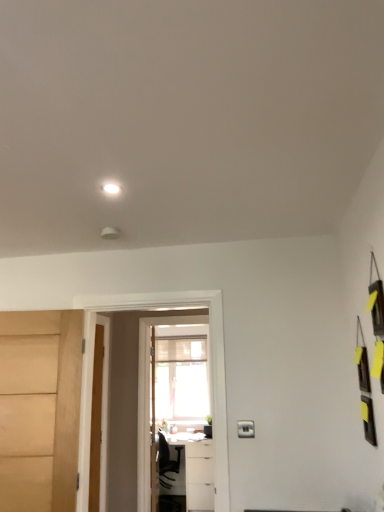
Find the location of a particular element. The height and width of the screenshot is (512, 384). matte wood door at left, placed as the 1th door when sorted from front to back is located at coordinates coord(39,409).

What is the approximate width of transparent glass screen door at center?

transparent glass screen door at center is 5.28 centimeters wide.

What do you see at coordinates (153, 432) in the screenshot? The width and height of the screenshot is (384, 512). I see `wooden door at center, which is counted as the 1th door, starting from the right` at bounding box center [153, 432].

Describe the element at coordinates (111, 188) in the screenshot. The height and width of the screenshot is (512, 384). I see `white glossy light at upper center` at that location.

The image size is (384, 512). Describe the element at coordinates (99, 417) in the screenshot. I see `wooden door at center, arranged as the second door when viewed from the back` at that location.

In order to face wooden door at center, the 2th door positioned from the left, should I rotate leftwards or rightwards?

You should look left and rotate roughly 13.026 degrees.

At what (x,y) coordinates should I click in order to perform the action: click on white glossy table at lower center. Please return your answer as a coordinate pair (x, y). The image size is (384, 512). Looking at the image, I should click on (188, 478).

Could you tell me if white glossy light at upper center is facing matte wood door at left, placed as the 1th door when sorted from front to back?

No.

From a real-world perspective, is white glossy light at upper center under matte wood door at left, positioned as the third door in right-to-left order?

Incorrect, from a real-world perspective, white glossy light at upper center is higher than matte wood door at left, positioned as the third door in right-to-left order.

Between white glossy light at upper center and matte wood door at left, which ranks as the 3th door in back-to-front order, which one appears on the right side from the viewer's perspective?

Result: Positioned to the right is white glossy light at upper center.

From their relative heights in the image, would you say white glossy light at upper center is taller or shorter than matte wood door at left, which ranks as the 3th door in back-to-front order?

Clearly, white glossy light at upper center is shorter compared to matte wood door at left, which ranks as the 3th door in back-to-front order.

Which object is positioned more to the right, transparent glass screen door at center or white glossy light at upper center?

transparent glass screen door at center is more to the right.

Between transparent glass screen door at center and white glossy light at upper center, which one has larger size?

With larger size is transparent glass screen door at center.

Is point (173, 413) closer or farther from the camera than point (113, 184)?

Point (173, 413) is farther from the camera than point (113, 184).

Could white glossy light at upper center be considered to be inside transparent glass screen door at center?

That's incorrect, white glossy light at upper center is not inside transparent glass screen door at center.

Can you tell me how much transparent glass screen door at center and matte wood door at left, which ranks as the 3th door in back-to-front order, differ in facing direction?

11.7 degrees separate the facing orientations of transparent glass screen door at center and matte wood door at left, which ranks as the 3th door in back-to-front order.

From a real-world perspective, is transparent glass screen door at center beneath matte wood door at left, placed as the 1th door when sorted from front to back?

Yes, from a real-world perspective, transparent glass screen door at center is below matte wood door at left, placed as the 1th door when sorted from front to back.

Could you tell me if transparent glass screen door at center is turned towards matte wood door at left, which appears as the 1th door when viewed from the left?

No, transparent glass screen door at center is not facing towards matte wood door at left, which appears as the 1th door when viewed from the left.

This screenshot has width=384, height=512. What are the coordinates of `screen door behind the matte wood door at left, which appears as the 1th door when viewed from the left` in the screenshot? It's located at (182, 380).

Is matte wood door at left, which ranks as the 3th door in back-to-front order, spatially inside white glossy light at upper center, or outside of it?

matte wood door at left, which ranks as the 3th door in back-to-front order, is not inside white glossy light at upper center, it's outside.

From a real-world perspective, is matte wood door at left, placed as the 1th door when sorted from front to back, positioned above or below white glossy light at upper center?

In terms of real-world spatial position, matte wood door at left, placed as the 1th door when sorted from front to back, is below white glossy light at upper center.

From the image's perspective, is matte wood door at left, placed as the 1th door when sorted from front to back, above or below white glossy light at upper center?

Based on their image positions, matte wood door at left, placed as the 1th door when sorted from front to back, is located beneath white glossy light at upper center.

Identify the location of door that is the 1st one when counting backward from the white glossy light at upper center. (39, 409).

Considering the relative sizes of transparent glass screen door at center and wooden door at center, the 3th door in the front-to-back sequence, in the image provided, is transparent glass screen door at center shorter than wooden door at center, the 3th door in the front-to-back sequence,?

Yes.

Looking at the image, does transparent glass screen door at center seem bigger or smaller compared to wooden door at center, which is counted as the 1th door, starting from the right?

transparent glass screen door at center is smaller than wooden door at center, which is counted as the 1th door, starting from the right.

Would you say transparent glass screen door at center is outside wooden door at center, the 3th door in the front-to-back sequence?

Yes, transparent glass screen door at center is outside of wooden door at center, the 3th door in the front-to-back sequence.

Between transparent glass screen door at center and wooden door at center, the 3th door in the front-to-back sequence, which one appears on the right side from the viewer's perspective?

transparent glass screen door at center is more to the right.

From the picture: Which object is closer to the camera, wooden door at center, the 2th door positioned from the left, or white glossy light at upper center?

white glossy light at upper center is closer to the camera.

In the scene shown: Would you say wooden door at center, the 2th door in the front-to-back sequence, is to the left or to the right of white glossy light at upper center in the picture?

wooden door at center, the 2th door in the front-to-back sequence, is positioned on white glossy light at upper center's left side.

Are wooden door at center, the 2th door in the front-to-back sequence, and white glossy light at upper center making contact?

There is a gap between wooden door at center, the 2th door in the front-to-back sequence, and white glossy light at upper center.

Does point (99, 322) appear closer or farther from the camera than point (110, 183)?

Point (99, 322) appears to be farther away from the viewer than point (110, 183).

Which is less distant, [4,396] or [93,502]?

Point [4,396] is positioned closer to the camera compared to point [93,502].

In the scene shown: Could you tell me if matte wood door at left, positioned as the third door in right-to-left order, is turned towards wooden door at center, the second door when ordered from right to left?

No, matte wood door at left, positioned as the third door in right-to-left order, is not aimed at wooden door at center, the second door when ordered from right to left.

What's the angular difference between matte wood door at left, placed as the 1th door when sorted from front to back, and wooden door at center, the 2th door in the front-to-back sequence,'s facing directions?

There is a 78.3-degree angle between the facing directions of matte wood door at left, placed as the 1th door when sorted from front to back, and wooden door at center, the 2th door in the front-to-back sequence.

Between matte wood door at left, positioned as the third door in right-to-left order, and wooden door at center, the second door when ordered from right to left, which one has larger width?

Wider between the two is matte wood door at left, positioned as the third door in right-to-left order.

Where is `light that appears above the matte wood door at left, placed as the 1th door when sorted from front to back (from the image's perspective)`? This screenshot has width=384, height=512. light that appears above the matte wood door at left, placed as the 1th door when sorted from front to back (from the image's perspective) is located at coordinates (111, 188).

Locate an element on the screen. The image size is (384, 512). screen door behind the white glossy light at upper center is located at coordinates (182, 380).

Which object lies further to the anchor point transparent glass screen door at center, matte wood door at left, which ranks as the 3th door in back-to-front order, or white glossy table at lower center?

matte wood door at left, which ranks as the 3th door in back-to-front order, is positioned further to the anchor transparent glass screen door at center.

When comparing their distances from matte wood door at left, which ranks as the 3th door in back-to-front order, does transparent glass screen door at center or wooden door at center, which is counted as the 1th door, starting from the right, seem closer?

wooden door at center, which is counted as the 1th door, starting from the right, lies closer to matte wood door at left, which ranks as the 3th door in back-to-front order, than the other object.

Which object lies further to the anchor point transparent glass screen door at center, wooden door at center, the 2th door in the front-to-back sequence, or white glossy table at lower center?

wooden door at center, the 2th door in the front-to-back sequence.

Based on their spatial positions, is white glossy light at upper center or matte wood door at left, which appears as the 1th door when viewed from the left, further from wooden door at center, marked as the 3th door in a left-to-right arrangement?

white glossy light at upper center is positioned further to the anchor wooden door at center, marked as the 3th door in a left-to-right arrangement.

Looking at the image, which one is located closer to white glossy light at upper center, transparent glass screen door at center or white glossy table at lower center?

The object closer to white glossy light at upper center is white glossy table at lower center.

Based on their spatial positions, is transparent glass screen door at center or matte wood door at left, positioned as the third door in right-to-left order, closer to white glossy light at upper center?

Among the two, matte wood door at left, positioned as the third door in right-to-left order, is located nearer to white glossy light at upper center.

Based on their spatial positions, is wooden door at center, the second door when ordered from right to left, or white glossy table at lower center closer to white glossy light at upper center?

wooden door at center, the second door when ordered from right to left, is closer to white glossy light at upper center.

Considering their positions, is wooden door at center, the 2th door in the front-to-back sequence, positioned further to transparent glass screen door at center than wooden door at center, which is counted as the 1th door, starting from the back?

wooden door at center, the 2th door in the front-to-back sequence.

This screenshot has height=512, width=384. I want to click on screen door between white glossy light at upper center and wooden door at center, marked as the 3th door in a left-to-right arrangement, in the front-back direction, so click(182, 380).

Image resolution: width=384 pixels, height=512 pixels. I want to click on screen door between matte wood door at left, positioned as the third door in right-to-left order, and wooden door at center, marked as the 3th door in a left-to-right arrangement, in the front-back direction, so click(182, 380).

Identify the location of door between white glossy light at upper center and wooden door at center, the 2th door positioned from the left, in the up-down direction. This screenshot has width=384, height=512. (39, 409).

This screenshot has width=384, height=512. Find the location of `door between transparent glass screen door at center and white glossy table at lower center along the z-axis`. door between transparent glass screen door at center and white glossy table at lower center along the z-axis is located at coordinates (153, 432).